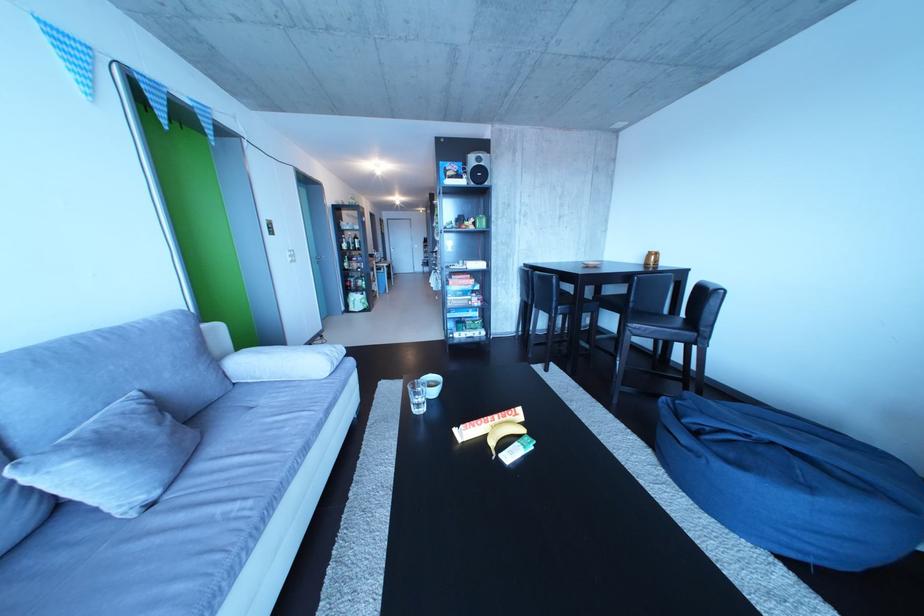
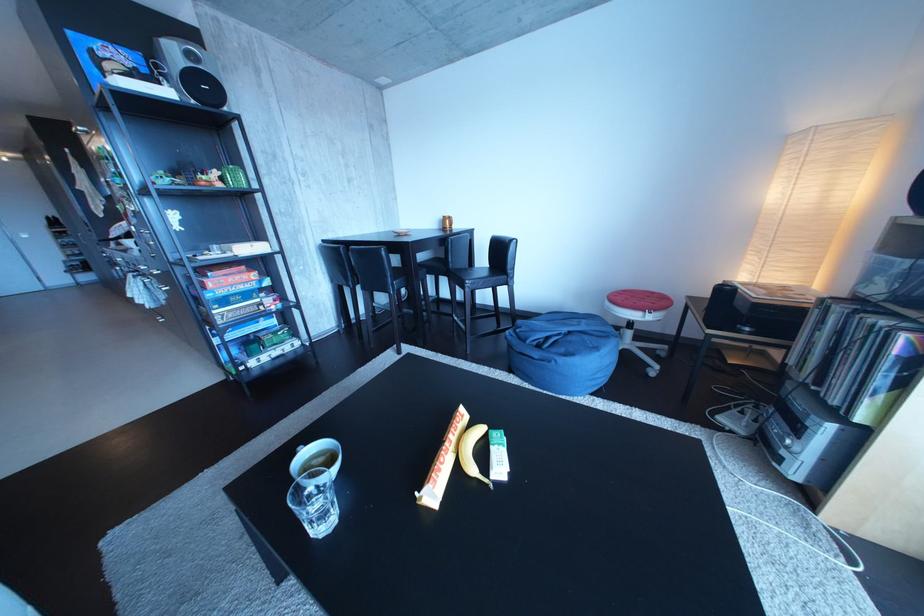
In the second image, find the point that corresponds to (503,424) in the first image.

(459, 450)